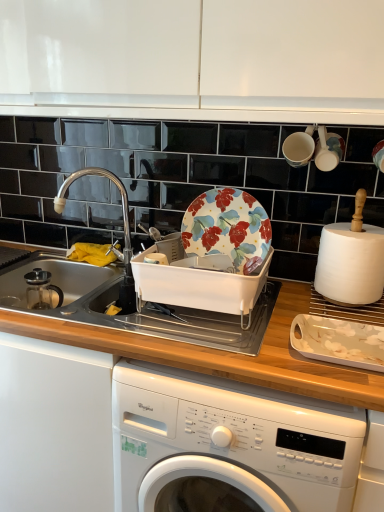
You are a GUI agent. You are given a task and a screenshot of the screen. Output one action in this format:
    pyautogui.click(x=<x>, y=<y>)
    Task: Click on the free space to the left of white matte paper towel at right
    Image resolution: width=384 pixels, height=512 pixels.
    Given the screenshot: What is the action you would take?
    pyautogui.click(x=290, y=292)